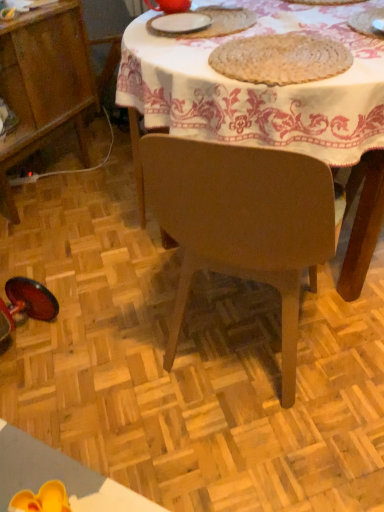
The height and width of the screenshot is (512, 384). Identify the location of vacant space situated on the left part of brown woven placemat at upper center. (175, 52).